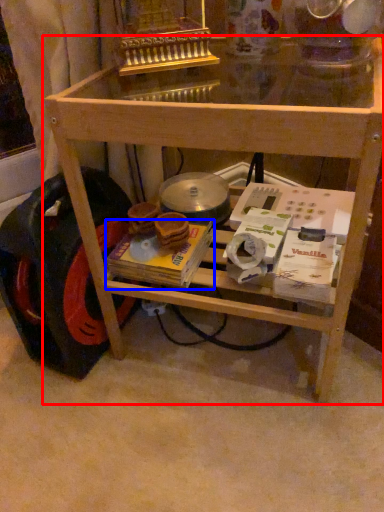
Question: Which of the following is the closest to the observer, table (highlighted by a red box) or magazine (highlighted by a blue box)?

Choices:
 (A) table
 (B) magazine

Answer: (A)